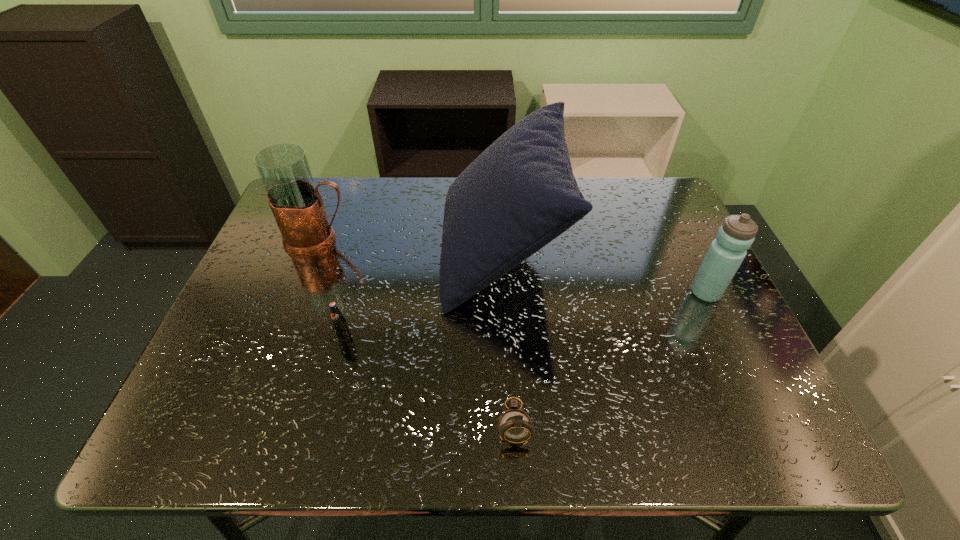
Find the location of `vacant space at the near edge`. vacant space at the near edge is located at coordinates (317, 435).

At what (x,y) coordinates should I click in order to perform the action: click on vacant space at the left edge of the desktop. Please return your answer as a coordinate pair (x, y). This screenshot has height=540, width=960. Looking at the image, I should click on (252, 386).

The height and width of the screenshot is (540, 960). Find the location of `vacant area at the right edge`. vacant area at the right edge is located at coordinates (641, 238).

Where is `free space at the near left corner`? This screenshot has width=960, height=540. free space at the near left corner is located at coordinates (217, 425).

In the image, there is a desktop. In order to click on vacant region at the far right corner in this screenshot , I will do `click(628, 178)`.

Image resolution: width=960 pixels, height=540 pixels. Identify the location of empty space that is in between the compass and the pitcher. coord(417,331).

Image resolution: width=960 pixels, height=540 pixels. I want to click on unoccupied area between the compass and the pop, so click(429, 380).

Locate an element on the screen. free space that is in between the water bottle and the second shortest object is located at coordinates (525, 315).

Find the location of a particular element. This screenshot has width=960, height=540. vacant area that lies between the second shortest object and the pitcher is located at coordinates (331, 289).

The height and width of the screenshot is (540, 960). Identify the location of free space between the tallest object and the pitcher. (410, 246).